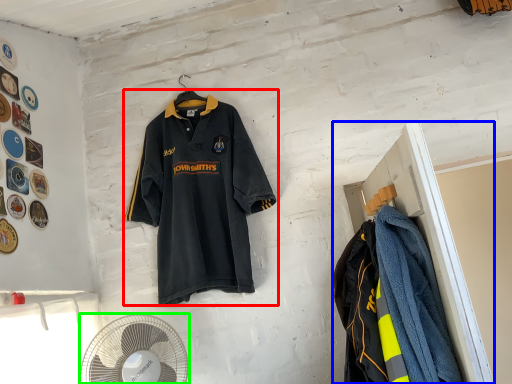
Question: Which object is the farthest from sports uniform (highlighted by a red box)? Choose among these: closet (highlighted by a blue box) or mechanical fan (highlighted by a green box).

Choices:
 (A) closet
 (B) mechanical fan

Answer: (A)